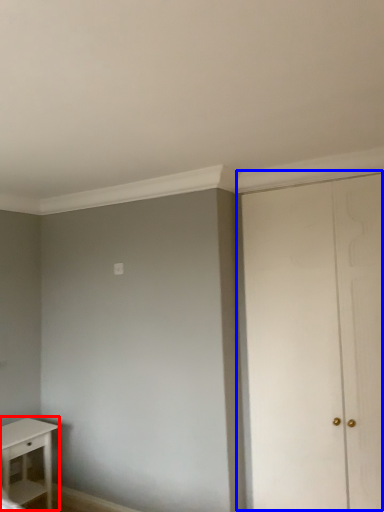
Question: Among these objects, which one is nearest to the camera, table (highlighted by a red box) or door (highlighted by a blue box)?

Choices:
 (A) table
 (B) door

Answer: (B)